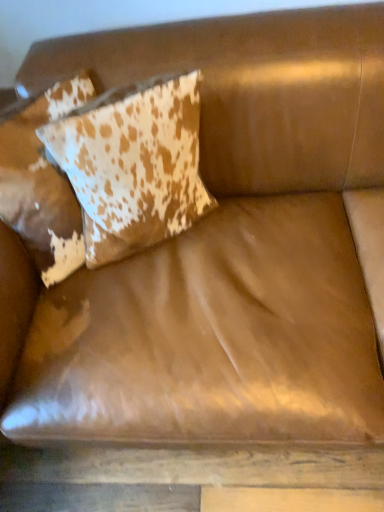
Question: In terms of size, does cowhide pillow at upper left, which appears as the 2th pillow when viewed from the left, appear bigger or smaller than cowhide pillow at upper left, which ranks as the second pillow in right-to-left order?

Choices:
 (A) small
 (B) big

Answer: (A)

Question: Considering the positions of point 132,88 and point 77,246, is point 132,88 closer or farther from the camera than point 77,246?

Choices:
 (A) farther
 (B) closer

Answer: (B)

Question: From a real-world perspective, is cowhide pillow at upper left, which appears as the 2th pillow when viewed from the left, positioned above or below cowhide pillow at upper left, which ranks as the first pillow in left-to-right order?

Choices:
 (A) below
 (B) above

Answer: (B)

Question: From a real-world perspective, is cowhide pillow at upper left, which ranks as the first pillow in left-to-right order, positioned above or below cowhide pillow at upper left, which is the first pillow from right to left?

Choices:
 (A) below
 (B) above

Answer: (A)

Question: From the image's perspective, relative to cowhide pillow at upper left, which is the first pillow from right to left, is cowhide pillow at upper left, which ranks as the first pillow in left-to-right order, above or below?

Choices:
 (A) below
 (B) above

Answer: (A)

Question: Considering the positions of point (1, 161) and point (183, 99), is point (1, 161) closer or farther from the camera than point (183, 99)?

Choices:
 (A) farther
 (B) closer

Answer: (B)

Question: Is cowhide pillow at upper left, which ranks as the first pillow in left-to-right order, bigger or smaller than cowhide pillow at upper left, which appears as the 2th pillow when viewed from the left?

Choices:
 (A) big
 (B) small

Answer: (A)